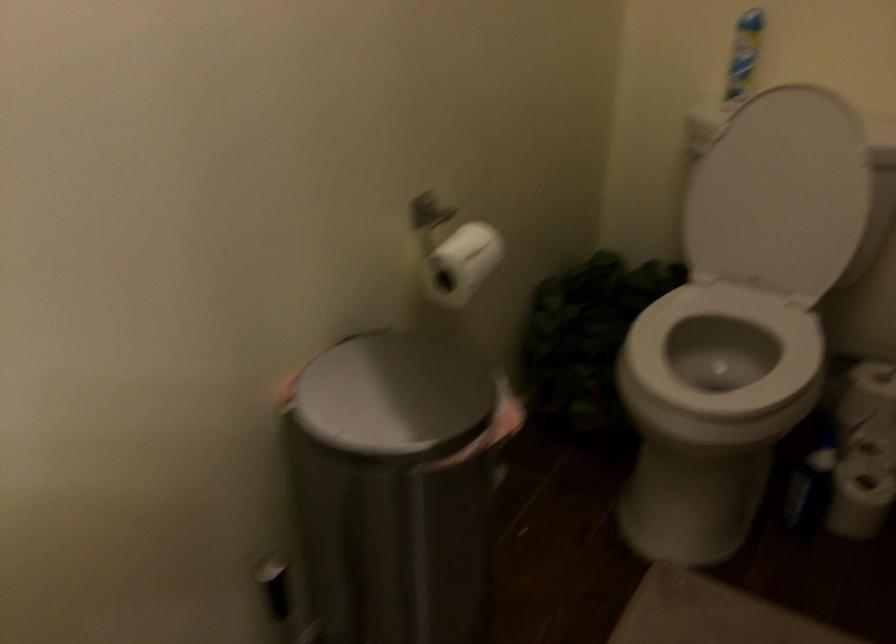
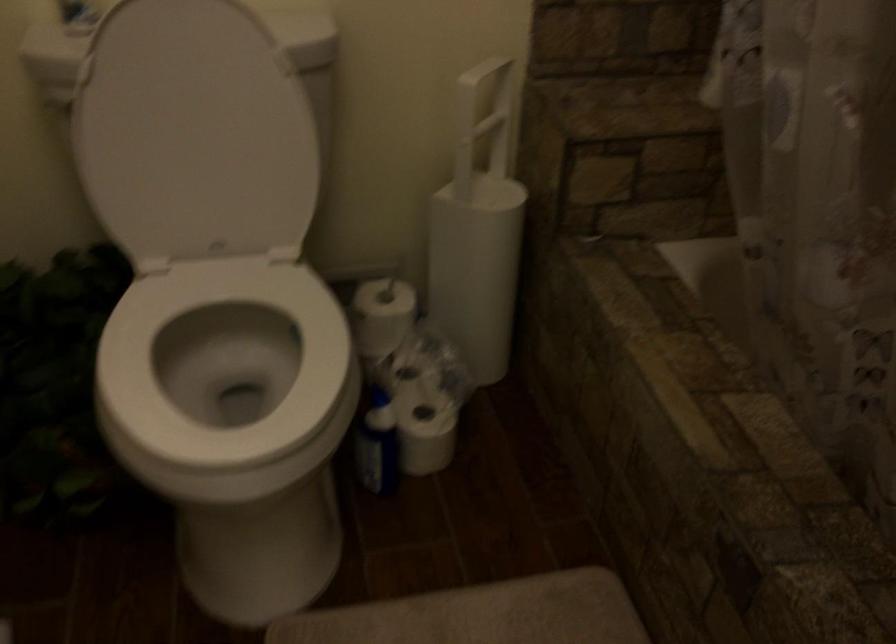
Find the pixel in the second image that matches [807,478] in the first image.

(375, 442)